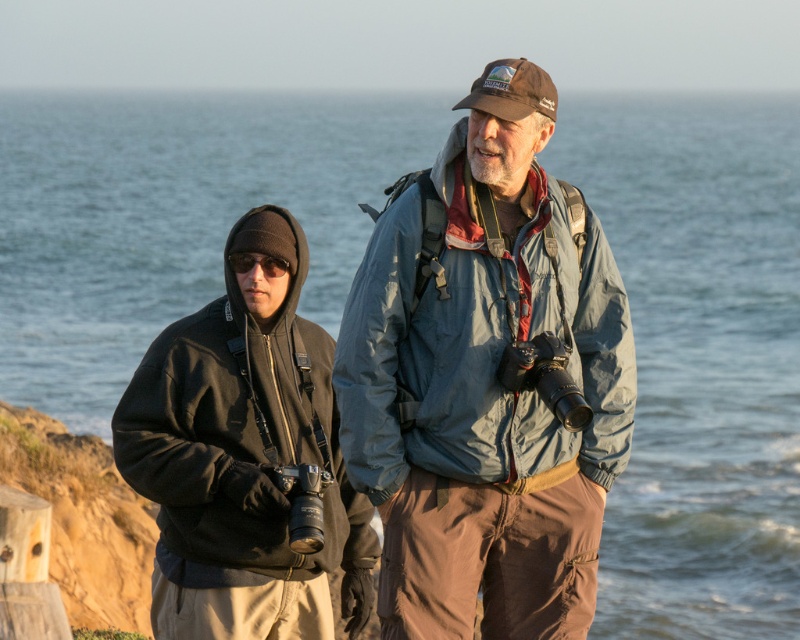
Image resolution: width=800 pixels, height=640 pixels. What do you see at coordinates (486, 381) in the screenshot?
I see `matte blue jacket at center` at bounding box center [486, 381].

Does matte blue jacket at center lie in front of dark gray fleece jacket at left?

That is True.

Between point (546, 195) and point (276, 216), which one is positioned behind?

The point (276, 216) is more distant.

This screenshot has width=800, height=640. I want to click on matte blue jacket at center, so click(486, 381).